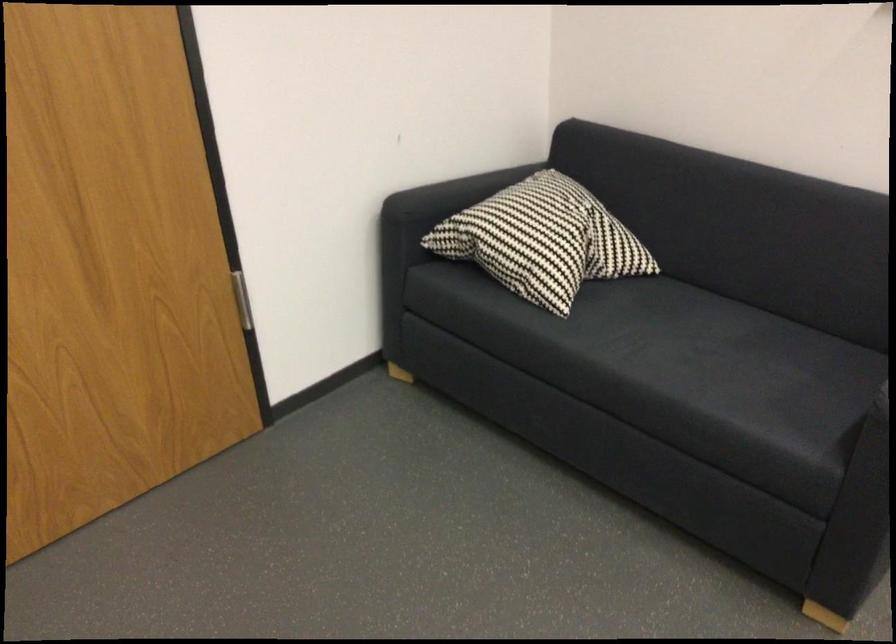
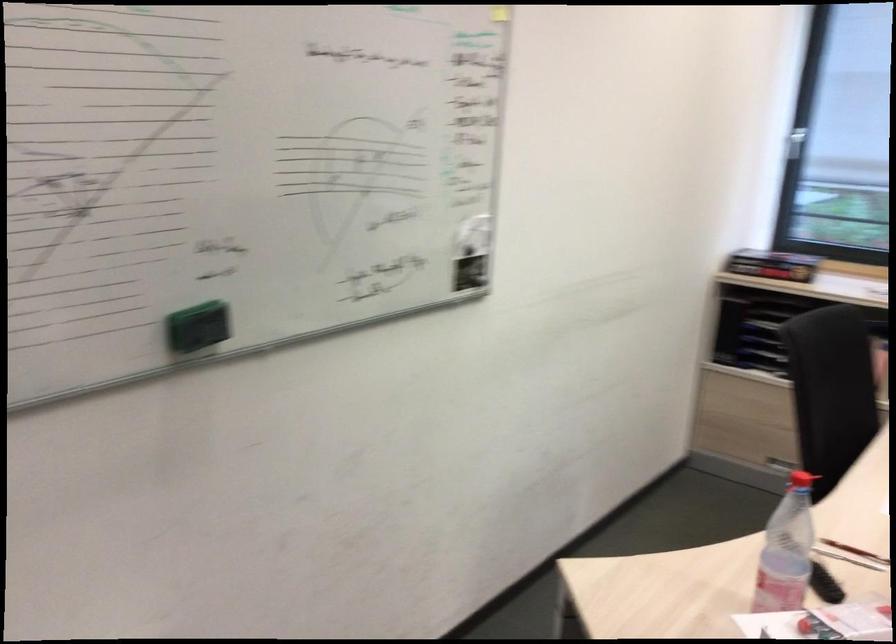
Based on the continuous images, in which direction is the camera rotating?

The rotation direction of the camera is right-down.